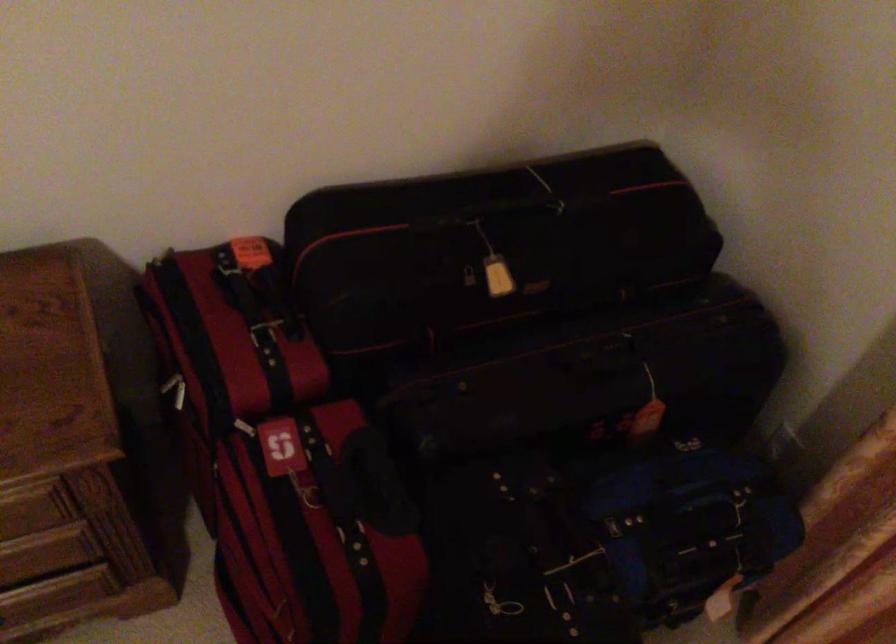
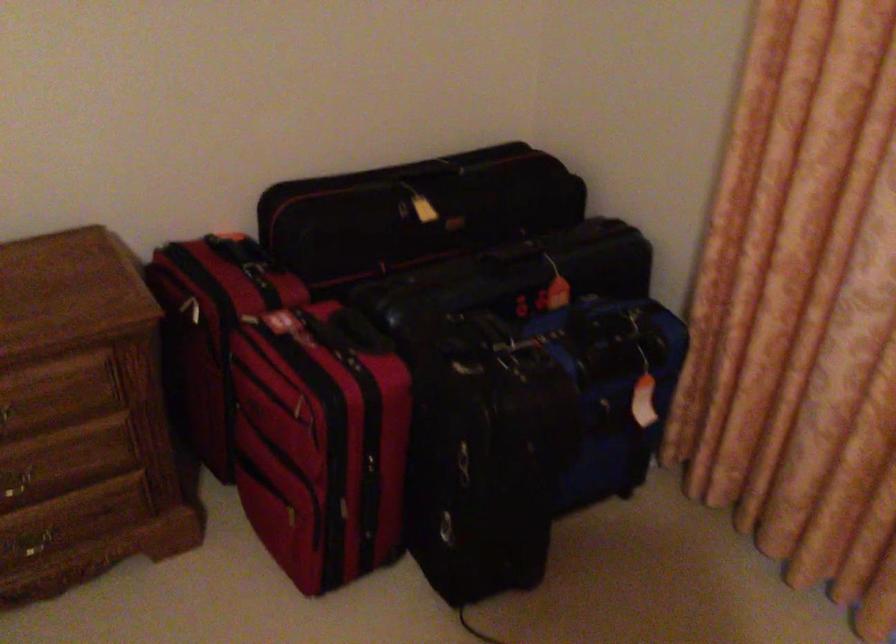
Question: The images are taken continuously from a first-person perspective. In which direction is your viewpoint rotating?

Choices:
 (A) Left
 (B) Right
 (C) Up
 (D) Down

Answer: (C)